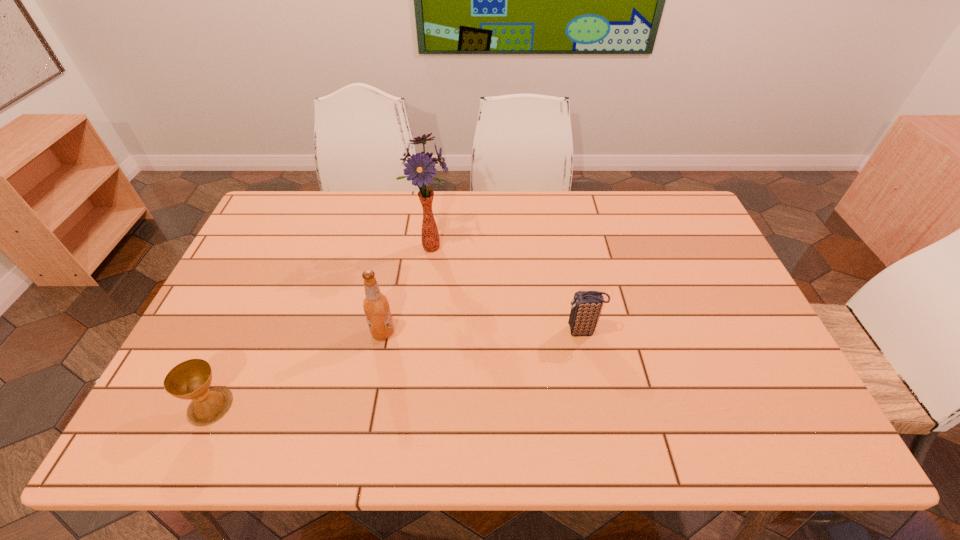
The width and height of the screenshot is (960, 540). Find the location of `vacant space at the right edge`. vacant space at the right edge is located at coordinates (697, 246).

Locate an element on the screen. free region at the far left corner is located at coordinates (275, 221).

Image resolution: width=960 pixels, height=540 pixels. I want to click on vacant space that is in between the rightmost object and the third shortest object, so click(x=483, y=332).

Locate an element on the screen. The width and height of the screenshot is (960, 540). empty space between the nearest object and the second shortest object is located at coordinates (396, 368).

The image size is (960, 540). I want to click on free space between the tallest object and the rightmost object, so click(507, 289).

The height and width of the screenshot is (540, 960). I want to click on free space between the tallest object and the clutch bag, so click(x=507, y=289).

You are a GUI agent. You are given a task and a screenshot of the screen. Output one action in this format:
    pyautogui.click(x=<x>, y=<y>)
    Task: Click on the vacant space that is in between the chalice and the farthest object
    
    Given the screenshot: What is the action you would take?
    pyautogui.click(x=321, y=326)

Where is `vacant area that lies between the nearest object and the third tallest object`? vacant area that lies between the nearest object and the third tallest object is located at coordinates (396, 368).

Identify the location of free space between the beer bottle and the leftmost object. (297, 369).

Where is `free spot between the tallest object and the second shortest object`? The image size is (960, 540). free spot between the tallest object and the second shortest object is located at coordinates (507, 289).